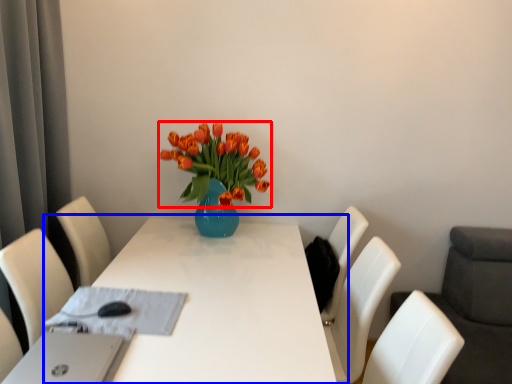
Question: Which of the following is the closest to the observer, flower (highlighted by a red box) or table (highlighted by a blue box)?

Choices:
 (A) flower
 (B) table

Answer: (B)